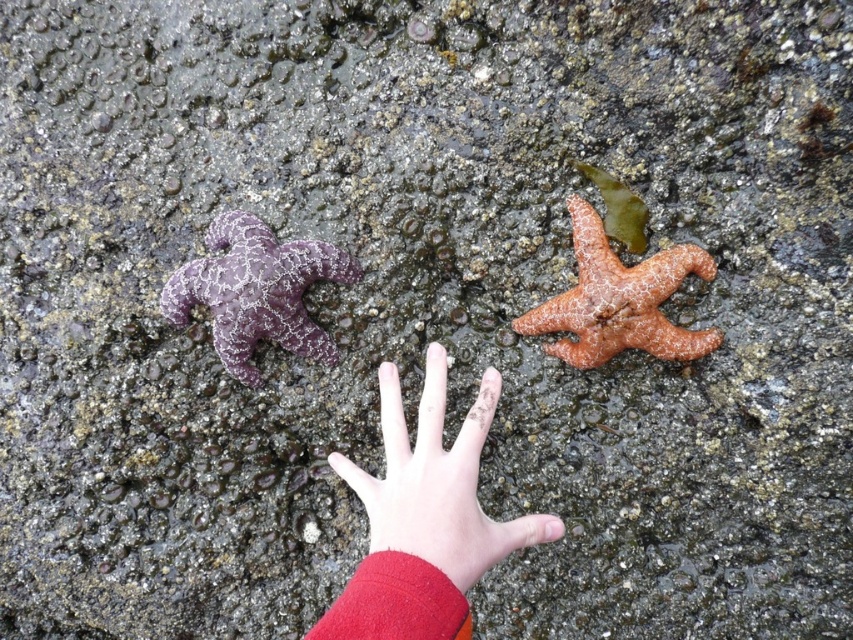
Looking at this image, is smooth skin hand at center to the right of orange matte starfish at center right from the viewer's perspective?

No, smooth skin hand at center is not to the right of orange matte starfish at center right.

Is point (471, 557) behind point (605, 355)?

No, (471, 557) is in front of (605, 355).

Between point (426, 476) and point (689, 248), which one is positioned in front?

Positioned in front is point (426, 476).

Where is `smooth skin hand at center`? The image size is (853, 640). smooth skin hand at center is located at coordinates (437, 481).

Can you confirm if purple matte starfish at left is smaller than orange matte starfish at center right?

Yes.

Between purple matte starfish at left and orange matte starfish at center right, which one is positioned lower?

purple matte starfish at left is lower down.

You are a GUI agent. You are given a task and a screenshot of the screen. Output one action in this format:
    pyautogui.click(x=<x>, y=<y>)
    Task: Click on the purple matte starfish at left
    
    Given the screenshot: What is the action you would take?
    pyautogui.click(x=256, y=291)

Between smooth skin hand at center and purple matte starfish at left, which one appears on the right side from the viewer's perspective?

smooth skin hand at center is more to the right.

Can you confirm if smooth skin hand at center is taller than purple matte starfish at left?

Indeed, smooth skin hand at center has a greater height compared to purple matte starfish at left.

This screenshot has height=640, width=853. What do you see at coordinates (437, 481) in the screenshot? I see `smooth skin hand at center` at bounding box center [437, 481].

The height and width of the screenshot is (640, 853). In order to click on smooth skin hand at center in this screenshot , I will do `click(437, 481)`.